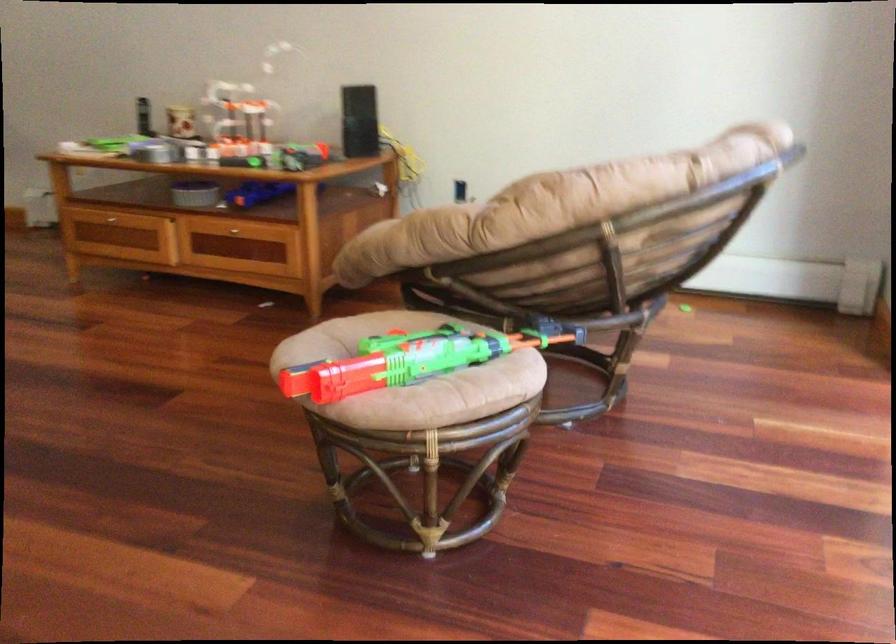
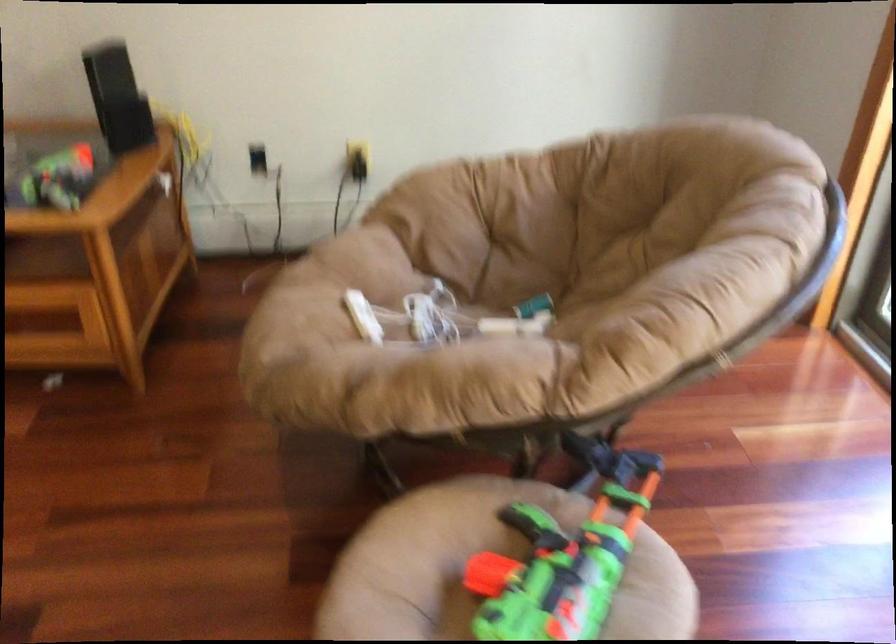
Find the pixel in the second image that matches point 306,211 in the first image.

(95, 263)